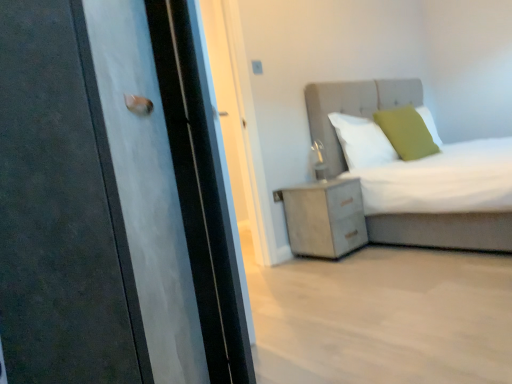
Question: Considering the positions of point (388, 137) and point (29, 91), is point (388, 137) closer or farther from the camera than point (29, 91)?

Choices:
 (A) farther
 (B) closer

Answer: (A)

Question: Is green matte pillow at upper right, acting as the first pillow starting from the right, wider or thinner than matte black door at left?

Choices:
 (A) thin
 (B) wide

Answer: (A)

Question: Estimate the real-world distances between objects in this image. Which object is closer to the white soft pillow at upper center, positioned as the 2th pillow in right-to-left order?

Choices:
 (A) matte gray bed at upper right
 (B) white textured cabinet at lower right
 (C) matte black door at left
 (D) green matte pillow at upper right, acting as the first pillow starting from the right

Answer: (A)

Question: Estimate the real-world distances between objects in this image. Which object is closer to the white soft pillow at upper center, positioned as the 2th pillow in right-to-left order?

Choices:
 (A) matte black door at left
 (B) matte gray bed at upper right
 (C) white textured cabinet at lower right
 (D) green matte pillow at upper right, the second pillow when ordered from left to right

Answer: (B)